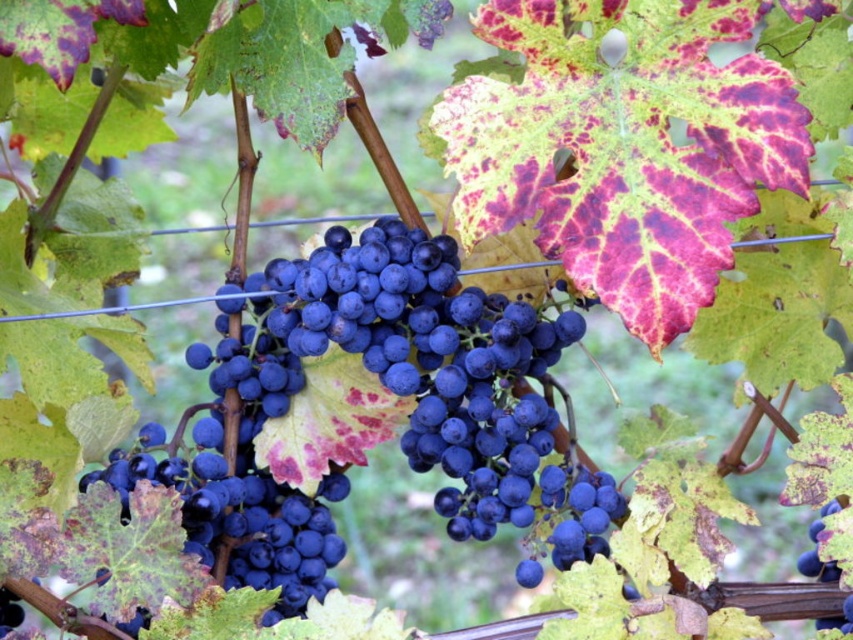
You are a farmer checking the grapevines and notice the shiny dark blue grapes at center. Where exactly are they positioned in terms of coordinates?

The shiny dark blue grapes at center are located at coordinates point (386, 388).

You are a farmer inspecting the grapes in the vineyard. You notice a point marked at coordinates (386, 388). What type of grapes are located at that point?

The point at coordinates (386, 388) indicates shiny dark blue grapes at center.